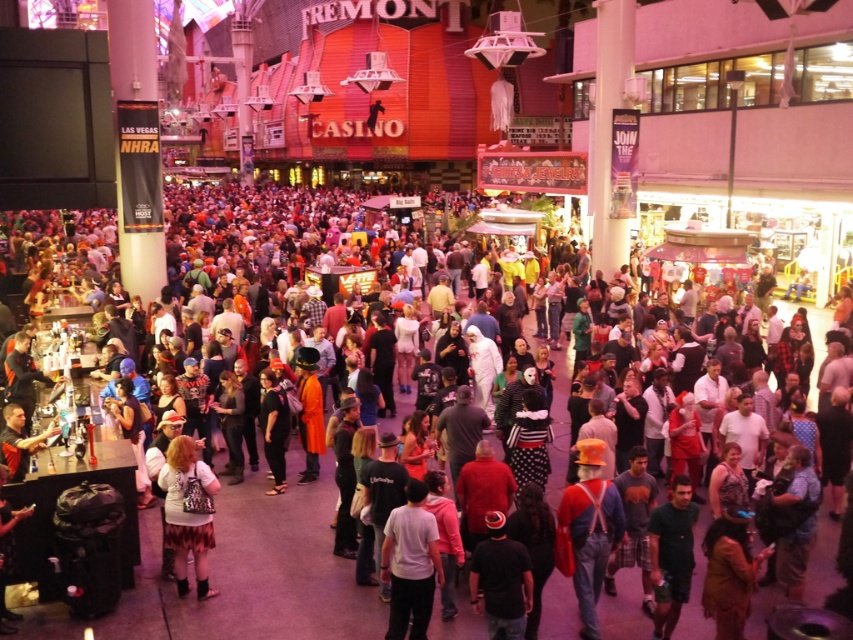
Question: Can you confirm if white matte shirt at center is positioned to the right of matte white shirt at lower left?

Choices:
 (A) no
 (B) yes

Answer: (B)

Question: Which of the following is the closest to the observer?

Choices:
 (A) matte white shirt at lower left
 (B) multicolored costumes at center
 (C) black matte jacket at center
 (D) orange felt hat at center

Answer: (D)

Question: Which object is closer to the camera taking this photo?

Choices:
 (A) multicolored costumes at center
 (B) orange felt hat at center
 (C) black matte jacket at center
 (D) matte white shirt at lower left

Answer: (B)

Question: Can you confirm if multicolored costumes at center is positioned below white matte shirt at center?

Choices:
 (A) no
 (B) yes

Answer: (A)

Question: Is the position of white matte shirt at center less distant than that of dark green shirt at center?

Choices:
 (A) yes
 (B) no

Answer: (A)

Question: Which point is closer to the camera taking this photo?

Choices:
 (A) (277, 397)
 (B) (831, 541)
 (C) (171, 531)

Answer: (C)